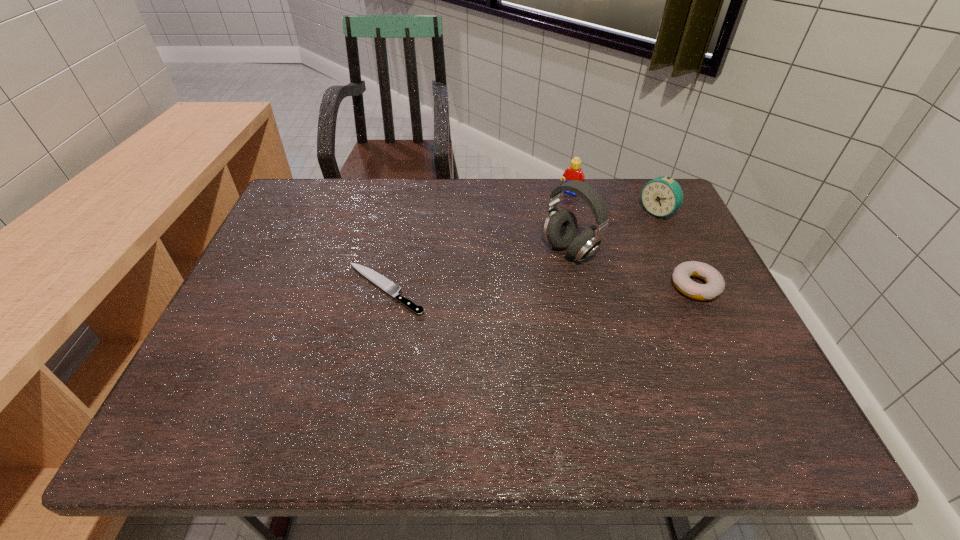
The image size is (960, 540). What are the coordinates of `vacant space on the desktop that is between the shortest object and the second shortest object and is positioned on the front-facing side of the alarm clock` in the screenshot? It's located at (552, 287).

The image size is (960, 540). Identify the location of vacant space on the desktop that is between the steak knife and the doughnut and is positioned on the front-facing side of the Lego. (495, 288).

Find the location of a particular element. free spot on the desktop that is between the leftmost object and the doughnut and is positioned on the ear cups of the tallest object is located at coordinates (506, 288).